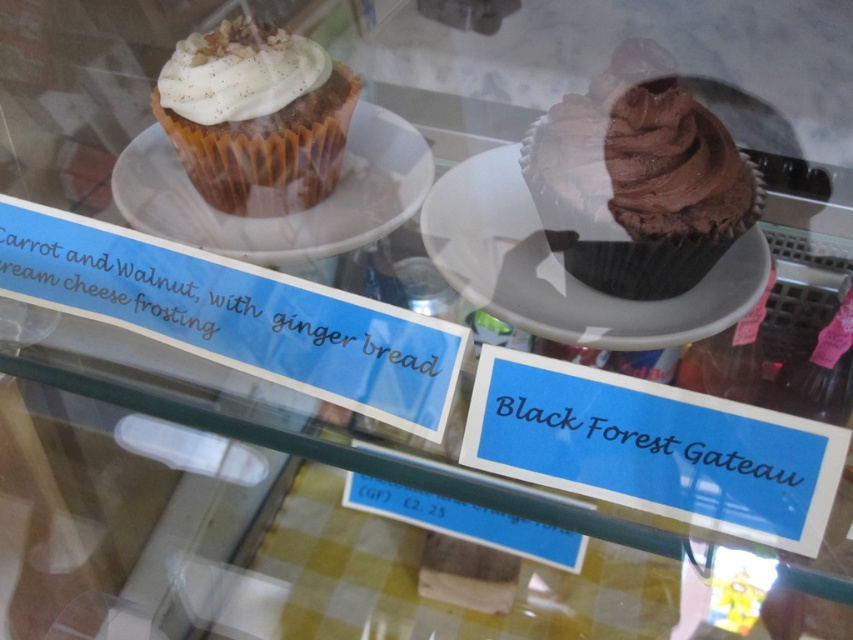
Between white paper plate at upper left and white cream at upper left, which one is positioned higher?

white cream at upper left is above.

Who is positioned more to the left, white paper plate at upper left or white cream at upper left?

white cream at upper left

Between point (198, 211) and point (257, 83), which one is positioned in front?

Point (257, 83) is more forward.

Locate an element on the screen. The height and width of the screenshot is (640, 853). white paper plate at upper left is located at coordinates (285, 214).

Between point (273, 77) and point (335, 195), which one is positioned in front?

Point (273, 77)

Does point (305, 44) come behind point (428, 180)?

That is False.

What are the coordinates of `matte brown cupcake at upper left` in the screenshot? It's located at (254, 115).

The width and height of the screenshot is (853, 640). What do you see at coordinates (563, 268) in the screenshot?
I see `matte white plate at center` at bounding box center [563, 268].

Consider the image. Does matte white plate at center appear under white paper plate at upper left?

Correct, matte white plate at center is located below white paper plate at upper left.

Find the location of a particular element. This screenshot has height=640, width=853. matte white plate at center is located at coordinates (563, 268).

Identify the location of matte white plate at center. (563, 268).